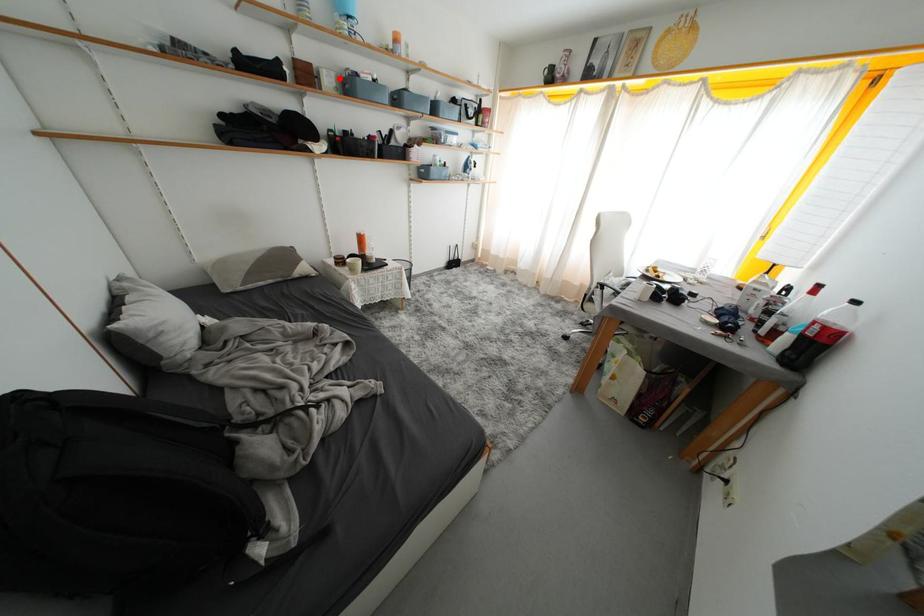
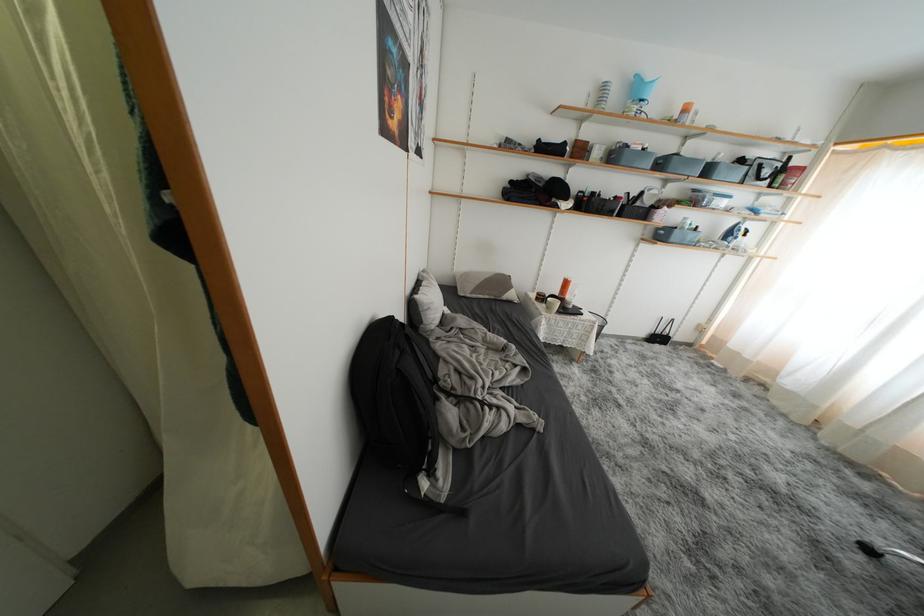
In the second image, find the point that corresponds to the highlighted location in the first image.

(610, 152)